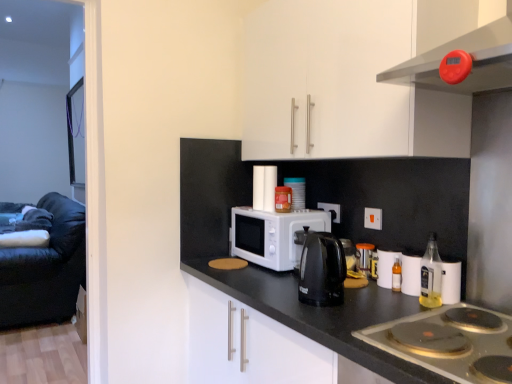
Where is `vacant space situated on the left part of translucent plastic bottle at lower right, the 1th appliance from the bottom`? vacant space situated on the left part of translucent plastic bottle at lower right, the 1th appliance from the bottom is located at coordinates (362, 285).